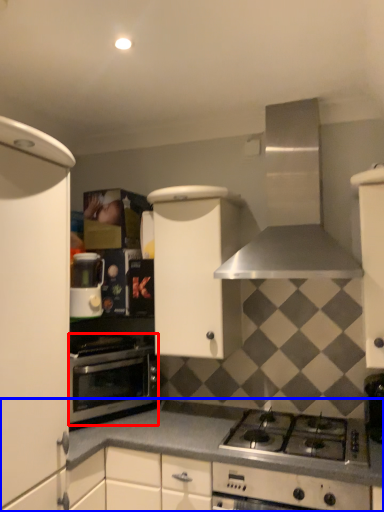
Question: Which point is closer to the camera, oven (highlighted by a red box) or countertop (highlighted by a blue box)?

Choices:
 (A) oven
 (B) countertop

Answer: (B)